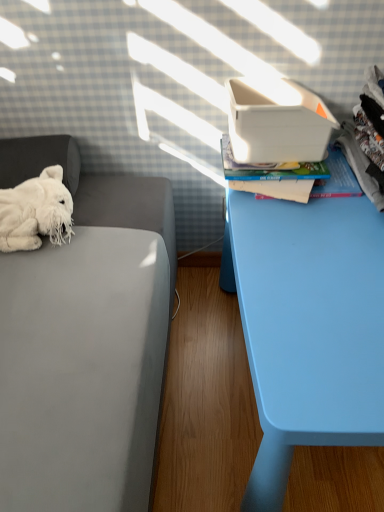
Find the location of a particular element. This screenshot has height=512, width=384. free space in front of hardcover book at upper right is located at coordinates (304, 244).